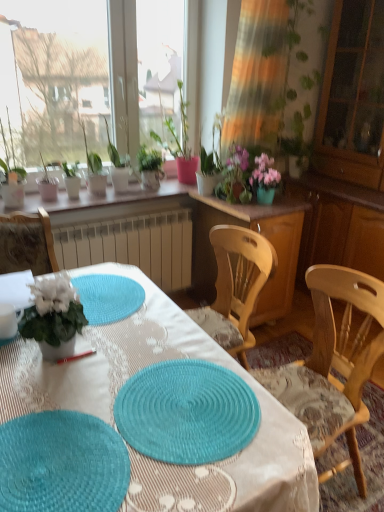
Locate an element on the screen. The height and width of the screenshot is (512, 384). free region under white matte plant at left, the 5th houseplant from the left (from a real-world perspective) is located at coordinates tap(69, 350).